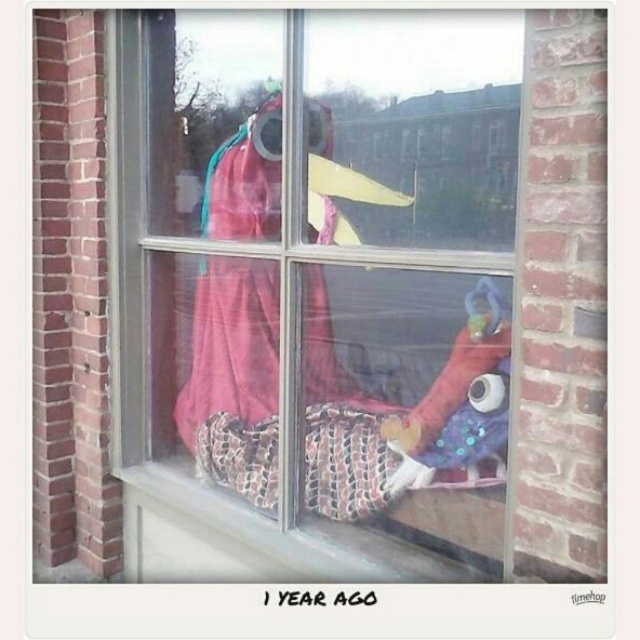
You are a delivery person who needs to place a small package on the windowsill. The windowsill has the white textured stone at lower center and the shiny blue fabric toy at center. Which object should you move to make space?

The white textured stone at lower center is positioned on the left side of the shiny blue fabric toy at center. To make space, you can move the white textured stone at lower center since it is located to the left of the toy, allowing you to place the package there.

You are standing 5 feet away from the window. Can you reach the point at coordinates point (428, 426) on the window?

The distance of point (428, 426) from viewer is 4.53 feet, so yes, you can reach the point at coordinates point (428, 426) on the window since you are standing closer than the required distance.